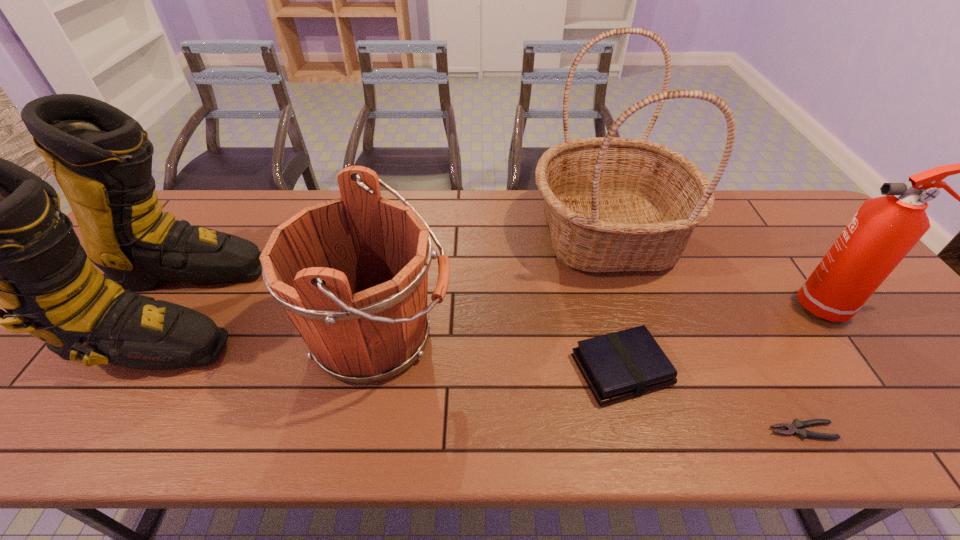
Where is `basket`? The image size is (960, 540). basket is located at coordinates (612, 204).

Where is `ski boots`? The width and height of the screenshot is (960, 540). ski boots is located at coordinates (0, 234).

At what (x,y) coordinates should I click in order to perform the action: click on fire extinguisher. Please return your answer as a coordinate pair (x, y). Looking at the image, I should click on pos(883,231).

This screenshot has width=960, height=540. I want to click on the fifth object from right to left, so click(x=351, y=273).

Where is `book`? The image size is (960, 540). book is located at coordinates (616, 366).

Find the location of a particular element. The width and height of the screenshot is (960, 540). the shortest object is located at coordinates (795, 428).

The width and height of the screenshot is (960, 540). What are the coordinates of `the nearest object` in the screenshot? It's located at (795, 428).

Image resolution: width=960 pixels, height=540 pixels. Find the location of `vacant space located on the left of the basket`. vacant space located on the left of the basket is located at coordinates (510, 235).

Find the location of a particular element. This screenshot has height=540, width=960. free region located on the back of the ski boots is located at coordinates (247, 191).

Find the location of a particular element. The image size is (960, 540). vacant space situated 0.220m at the nozzle of the fire extinguisher is located at coordinates (711, 307).